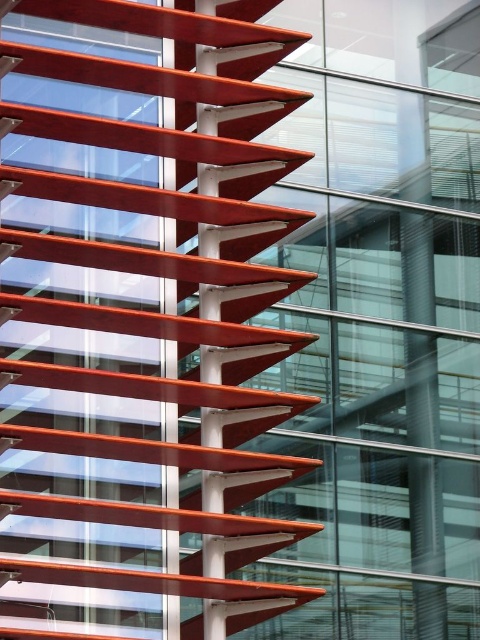
This screenshot has width=480, height=640. Find the location of `matte red staircase at left`. matte red staircase at left is located at coordinates (142, 321).